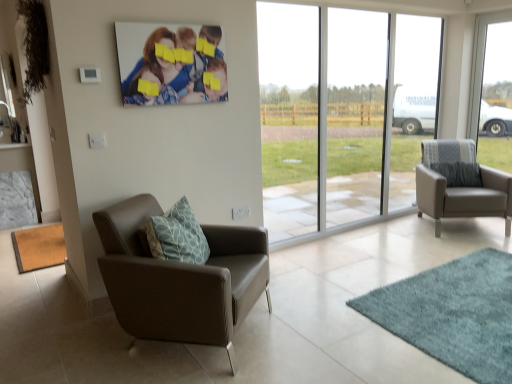
Question: Does transparent glass window at right, which is counted as the 1th window, starting from the right, come in front of matte canvas print at upper center?

Choices:
 (A) no
 (B) yes

Answer: (A)

Question: From a real-world perspective, is transparent glass window at right, which is counted as the 1th window, starting from the right, positioned under matte canvas print at upper center based on gravity?

Choices:
 (A) yes
 (B) no

Answer: (A)

Question: Does transparent glass window at right, the 2th window from the left, have a larger size compared to matte canvas print at upper center?

Choices:
 (A) yes
 (B) no

Answer: (A)

Question: Is transparent glass window at right, which is counted as the 1th window, starting from the right, directly adjacent to matte canvas print at upper center?

Choices:
 (A) yes
 (B) no

Answer: (B)

Question: Is transparent glass window at right, which is counted as the 1th window, starting from the right, to the right of matte canvas print at upper center from the viewer's perspective?

Choices:
 (A) yes
 (B) no

Answer: (A)

Question: Is transparent glass window at right, which is counted as the 1th window, starting from the right, at the left side of matte canvas print at upper center?

Choices:
 (A) no
 (B) yes

Answer: (A)

Question: From the image's perspective, is white plastic power outlet at lower center above matte canvas print at upper center?

Choices:
 (A) no
 (B) yes

Answer: (A)

Question: Can you confirm if white plastic power outlet at lower center is bigger than matte canvas print at upper center?

Choices:
 (A) no
 (B) yes

Answer: (A)

Question: Does white plastic power outlet at lower center appear on the right side of matte canvas print at upper center?

Choices:
 (A) no
 (B) yes

Answer: (B)

Question: Is matte canvas print at upper center inside white plastic power outlet at lower center?

Choices:
 (A) yes
 (B) no

Answer: (B)

Question: Is white plastic power outlet at lower center wider than matte canvas print at upper center?

Choices:
 (A) yes
 (B) no

Answer: (B)

Question: Can you confirm if white plastic power outlet at lower center is taller than matte canvas print at upper center?

Choices:
 (A) no
 (B) yes

Answer: (A)

Question: Could you tell me if transparent glass window at right, which is counted as the 1th window, starting from the right, is facing transparent glass window at center, which appears as the first window when viewed from the left?

Choices:
 (A) yes
 (B) no

Answer: (B)